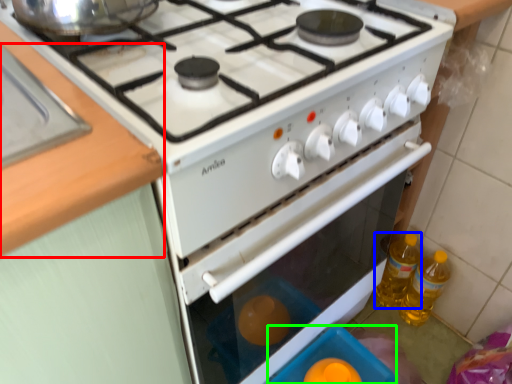
Question: Considering the real-world distances, which object is closest to counter top (highlighted by a red box)? bottle (highlighted by a blue box) or appliance (highlighted by a green box).

Choices:
 (A) bottle
 (B) appliance

Answer: (B)